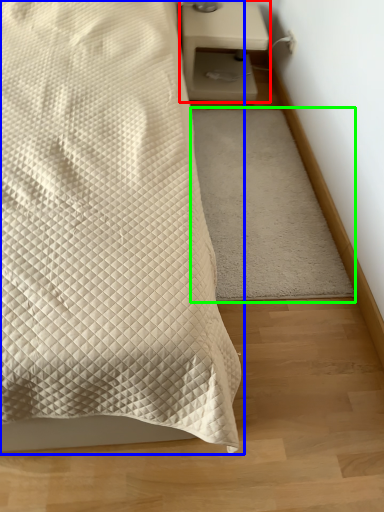
Question: Which object is positioned closest to nightstand (highlighted by a red box)? Select from bed (highlighted by a blue box) and mat (highlighted by a green box).

Choices:
 (A) bed
 (B) mat

Answer: (B)